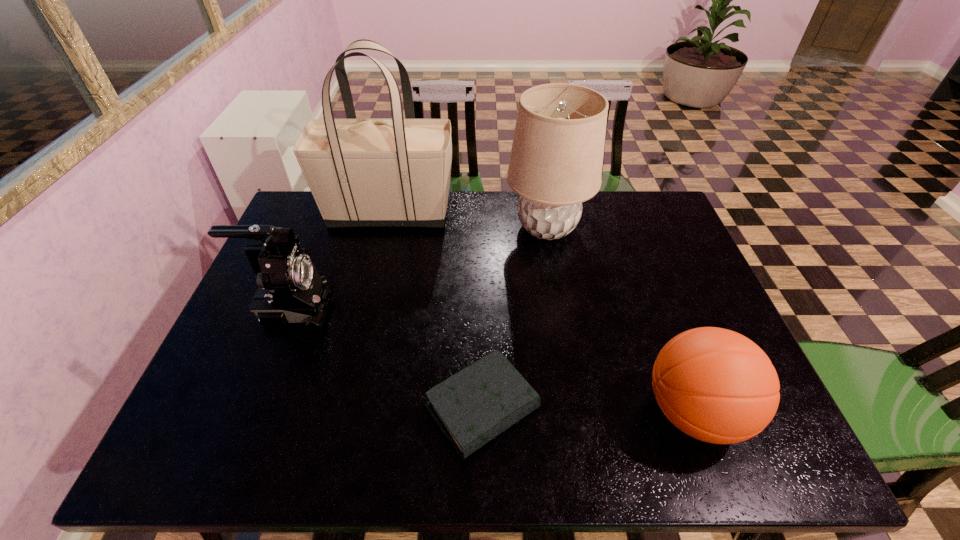
The image size is (960, 540). What are the coordinates of `free space at the far edge of the desktop` in the screenshot? It's located at (460, 211).

Where is `free location at the left edge`? free location at the left edge is located at coordinates (308, 245).

This screenshot has width=960, height=540. I want to click on vacant space at the right edge of the desktop, so click(x=708, y=293).

The height and width of the screenshot is (540, 960). Identify the location of blank space at the far left corner of the desktop. (318, 219).

The height and width of the screenshot is (540, 960). I want to click on empty space between the shortest object and the third farthest object, so click(387, 357).

You are a GUI agent. You are given a task and a screenshot of the screen. Output one action in this format:
    pyautogui.click(x=<x>, y=<y>)
    Task: Click on the free space between the rightmost object and the shopping bag
    The image size is (960, 540).
    Given the screenshot: What is the action you would take?
    541,312

You are a GUI agent. You are given a task and a screenshot of the screen. Output one action in this format:
    pyautogui.click(x=<x>, y=<y>)
    Task: Click on the vacant area that lies between the shortest object and the shopping bag
    This screenshot has height=540, width=960.
    Given the screenshot: What is the action you would take?
    pyautogui.click(x=436, y=310)

Locate an element on the screen. vacant area that lies between the Bible and the tallest object is located at coordinates (436, 310).

Locate an element on the screen. free spot between the basketball and the shortest object is located at coordinates (588, 410).

The image size is (960, 540). Identify the location of free point between the tallest object and the Bible. (436, 310).